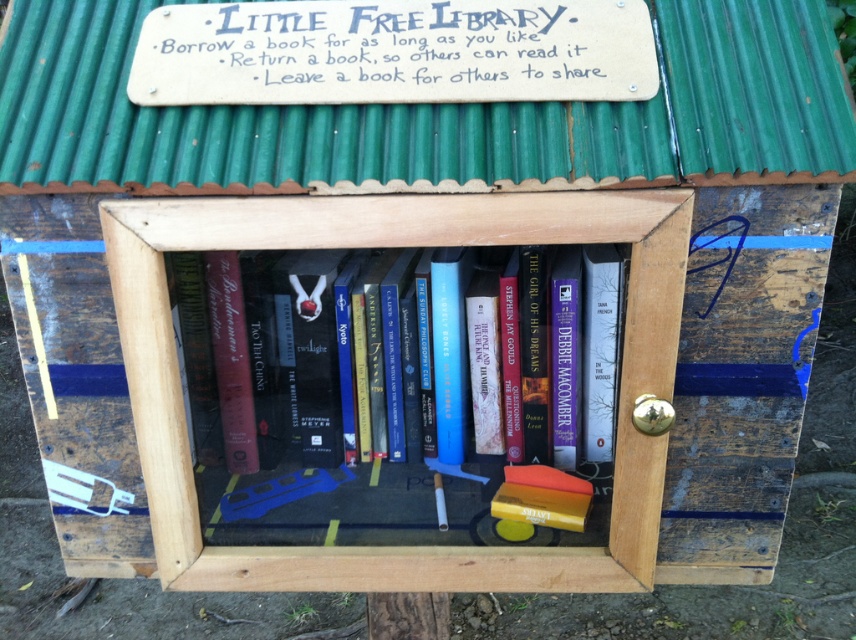
In the scene shown: You are a librarian trying to organize books in the Little Free Library. You have a hardcover book at center that needs to be placed on the wooden bookshelf at center. Can the book fit vertically on the shelf?

The wooden bookshelf at center is taller than the hardcover book at center, so yes, the hardcover book at center can fit vertically on the wooden bookshelf at center.